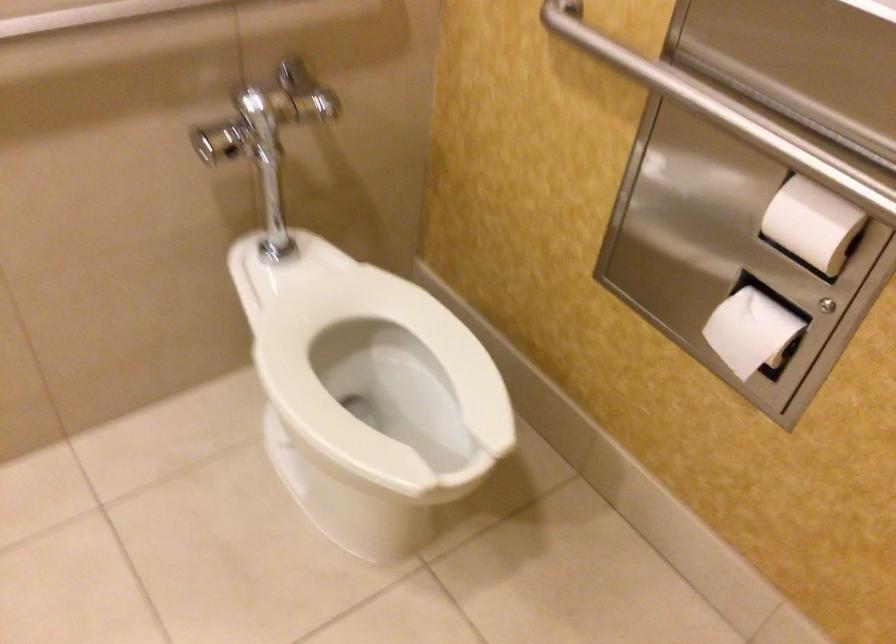
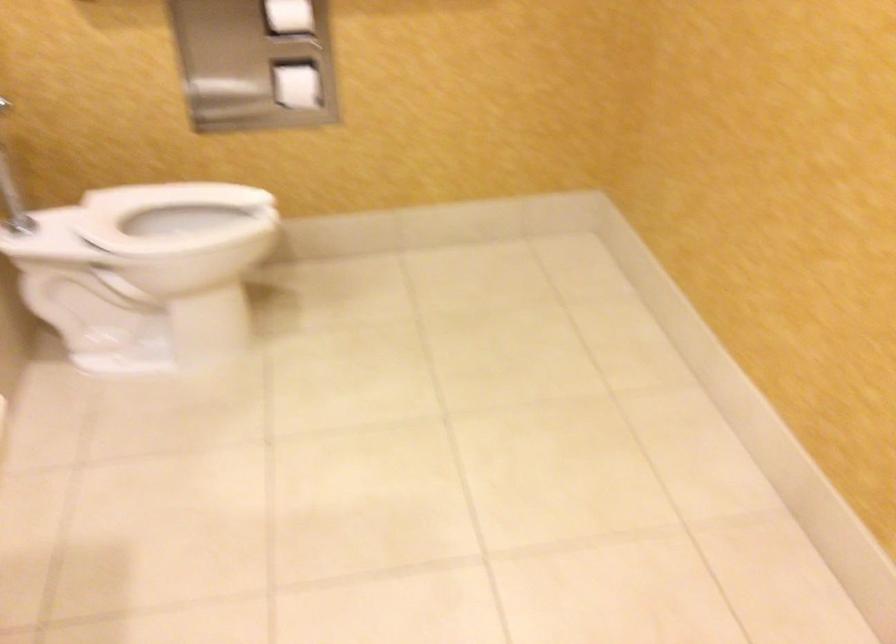
In the second image, find the point that corresponds to point 392,193 in the first image.

(12, 191)